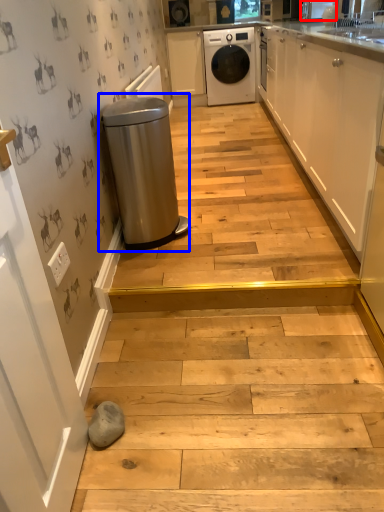
Question: Which object appears farthest to the camera in this image, appliance (highlighted by a red box) or waste container (highlighted by a blue box)?

Choices:
 (A) appliance
 (B) waste container

Answer: (A)